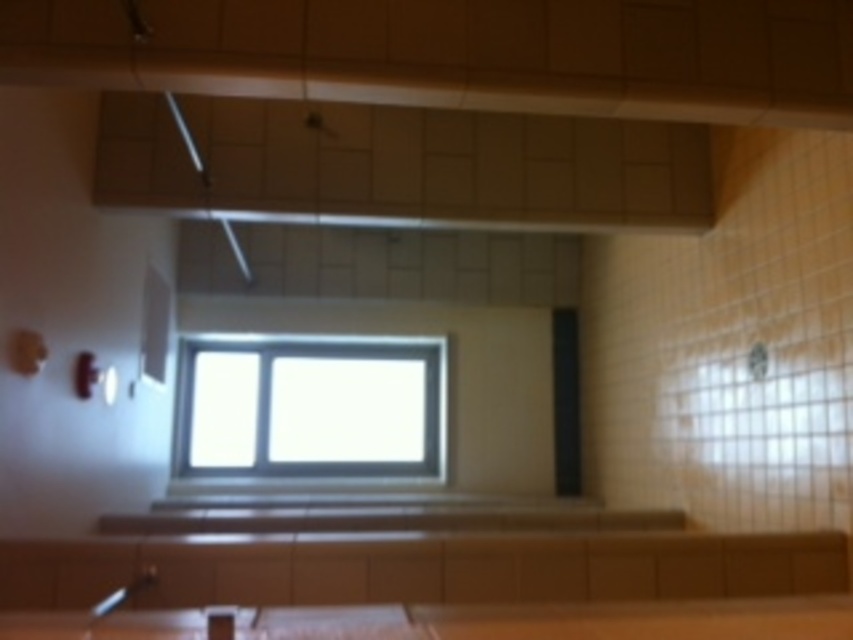
Looking at this image, can you confirm if clear glass window at center is positioned to the left of brown wood counter top at lower center?

Correct, you'll find clear glass window at center to the left of brown wood counter top at lower center.

Between clear glass window at center and brown wood counter top at lower center, which one is positioned lower?

clear glass window at center is below.

Between point (177, 467) and point (621, 609), which one is positioned behind?

The point (177, 467) is behind.

Identify the location of clear glass window at center. This screenshot has width=853, height=640. (310, 406).